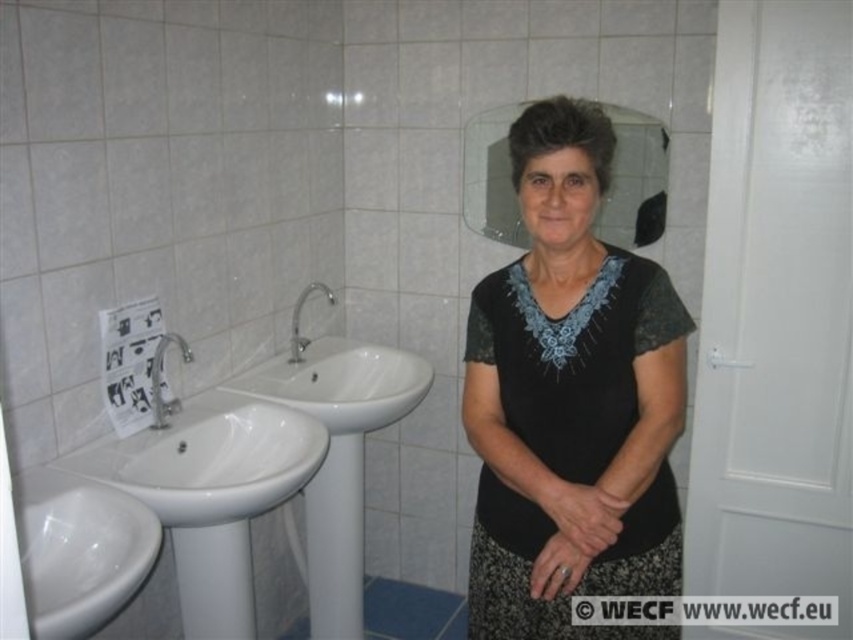
Question: Does silver metallic faucet at left have a smaller size compared to silver metallic faucet at center?

Choices:
 (A) yes
 (B) no

Answer: (A)

Question: Which is farther from the black lace dress at center?

Choices:
 (A) white glossy sink at lower left
 (B) silver metallic faucet at center
 (C) white glossy sink at left

Answer: (B)

Question: Among these objects, which one is nearest to the camera?

Choices:
 (A) silver metallic faucet at left
 (B) white glossy sink at lower left
 (C) white glossy sink at center
 (D) white glossy sink at left

Answer: (B)

Question: Does white glossy sink at center appear on the left side of silver metallic faucet at left?

Choices:
 (A) yes
 (B) no

Answer: (B)

Question: Which object is positioned closest to the silver metallic faucet at left?

Choices:
 (A) white glossy sink at lower left
 (B) white glossy sink at left
 (C) black lace dress at center

Answer: (B)

Question: Is white glossy sink at lower left positioned before silver metallic faucet at left?

Choices:
 (A) no
 (B) yes

Answer: (B)